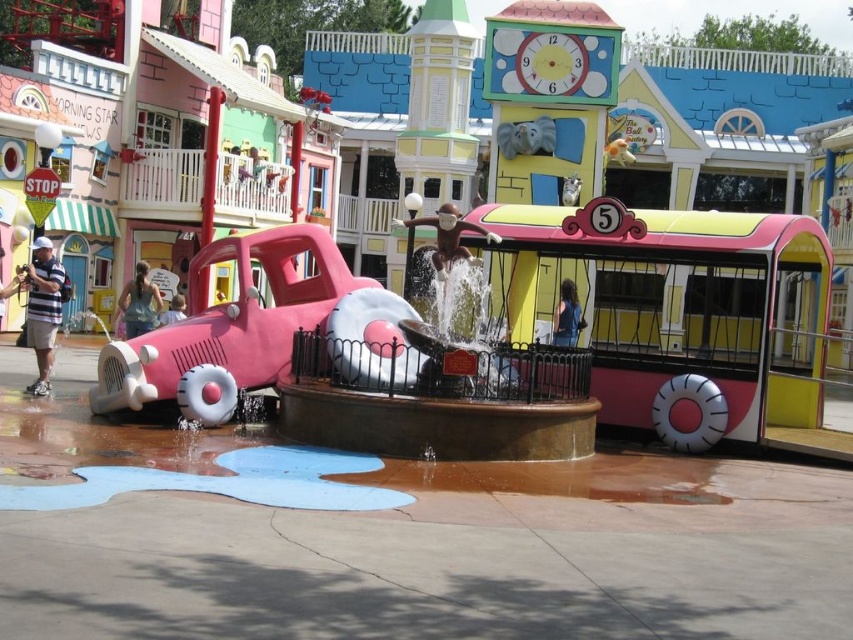
You are a visitor at the theme park and want to take a photo with both the matte pink car at center and the pink rubber car at center. Since the fence is in the way, you need to move to a spot where both cars are visible. Based on their sizes, which car will appear bigger in your photo?

The matte pink car at center will appear bigger in your photo because it is larger in size than the pink rubber car at center.

You are a visitor at the theme park and want to take a photo of both the matte pink car at center and the pink rubber car at center. Which one should you stand closer to in order to capture both in the same frame?

You should stand closer to the pink rubber car at center because the matte pink car at center is positioned on the right side of it, so placing yourself near the pink rubber car at center will help include both in your photo.

You are a parent trying to decide whether to let your child play near the pink rubber car at center and the blue denim jacket at center. Considering their sizes, which object is taller and could potentially block the child from seeing the nearby attractions?

The pink rubber car at center is much taller than the blue denim jacket at center, so it could potentially block the child from seeing the nearby attractions.